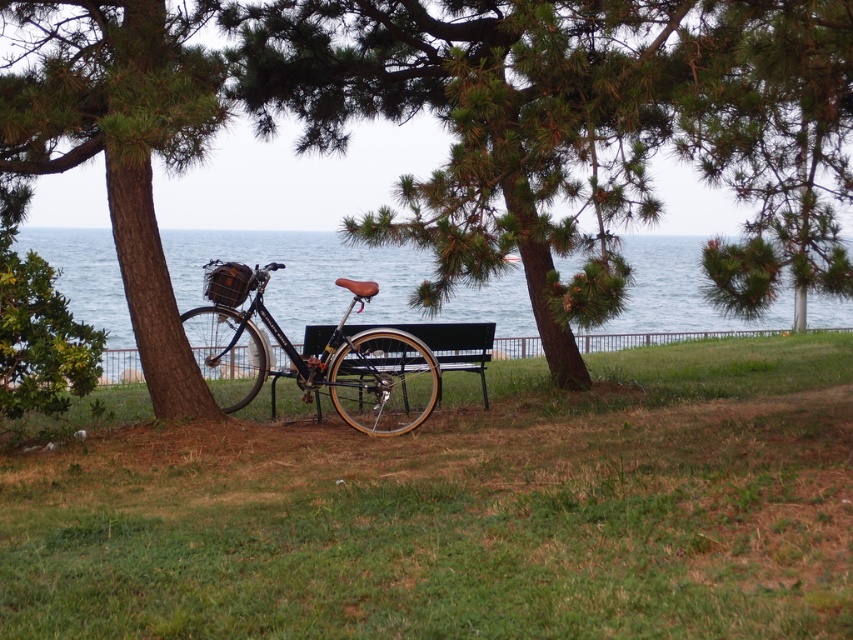
You are standing on the beach and looking towards the sea. You see green grass at center and blue water at center. Which one is closer to your feet?

The green grass at center is closer to your feet because it is located below the blue water at center, which is further away.

You are planning to place a small birdhouse on the green textured tree trunk at left and the blue water at center. Which location would be more suitable for the birdhouse based on their sizes?

The green textured tree trunk at left is thinner than the blue water at center, so the birdhouse would be more suitable on the tree trunk since it requires a narrower base.